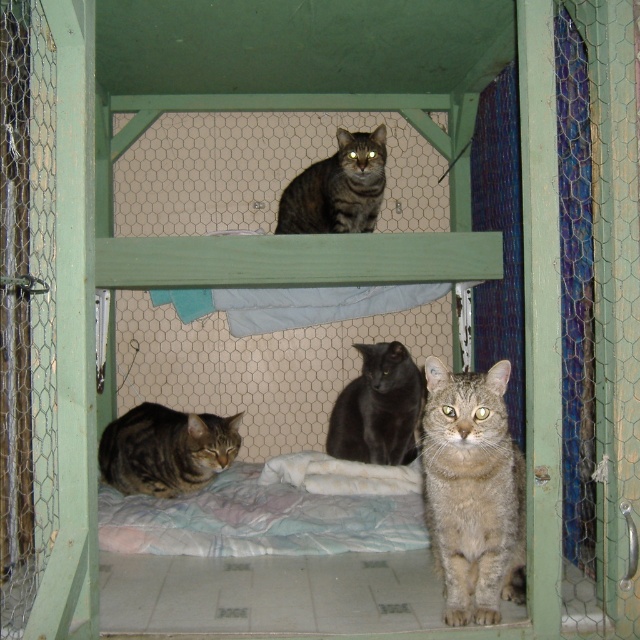
Question: In this image, where is tabby fur cat at center located relative to tabby fur cat at lower left?

Choices:
 (A) above
 (B) below

Answer: (A)

Question: Where is tabby fur cat at center located in relation to tabby fur cat at lower left in the image?

Choices:
 (A) below
 (B) above

Answer: (B)

Question: Which of the following is the farthest from the observer?

Choices:
 (A) (408, 416)
 (B) (493, 605)
 (C) (342, 204)

Answer: (A)

Question: Estimate the real-world distances between objects in this image. Which object is farther from the tabby fur cat at upper center?

Choices:
 (A) tabby fur cat at lower left
 (B) black glossy cat at center

Answer: (A)

Question: Which object is positioned farthest from the tabby fur cat at upper center?

Choices:
 (A) tabby fur cat at center
 (B) tabby fur cat at lower left
 (C) black glossy cat at center

Answer: (A)

Question: Can you confirm if tabby fur cat at lower left is thinner than black glossy cat at center?

Choices:
 (A) no
 (B) yes

Answer: (A)